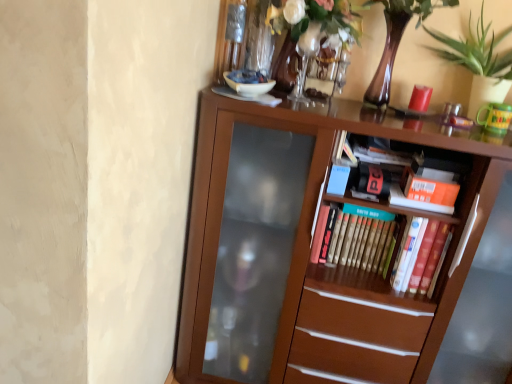
Question: Does hardcover book at center, which appears as the 3th paperback book when viewed from the right, appear on the right side of brown wooden bookcase at center?

Choices:
 (A) no
 (B) yes

Answer: (A)

Question: From a real-world perspective, is hardcover book at center, which appears as the 3th paperback book when viewed from the right, located higher than brown wooden bookcase at center?

Choices:
 (A) yes
 (B) no

Answer: (A)

Question: From the image's perspective, is hardcover book at center, which appears as the 3th paperback book when viewed from the right, on top of brown wooden bookcase at center?

Choices:
 (A) no
 (B) yes

Answer: (B)

Question: Is hardcover book at center, which appears as the 3th paperback book when viewed from the right, aimed at brown wooden bookcase at center?

Choices:
 (A) no
 (B) yes

Answer: (B)

Question: Can you confirm if hardcover book at center, which appears as the 3th paperback book when viewed from the right, is positioned to the left of brown wooden bookcase at center?

Choices:
 (A) yes
 (B) no

Answer: (A)

Question: Looking at their shapes, would you say orange matte paperback book at upper right, arranged as the first paperback book when viewed from the right, is wider or thinner than hardcover book at center, positioned as the second paperback book in left-to-right order?

Choices:
 (A) wide
 (B) thin

Answer: (B)

Question: Is orange matte paperback book at upper right, which is counted as the third paperback book, starting from the left, inside the boundaries of hardcover book at center, positioned as the second paperback book in left-to-right order, or outside?

Choices:
 (A) inside
 (B) outside

Answer: (B)

Question: Considering the positions of point (421, 187) and point (402, 254), is point (421, 187) closer or farther from the camera than point (402, 254)?

Choices:
 (A) farther
 (B) closer

Answer: (B)

Question: Looking at the image, does orange matte paperback book at upper right, arranged as the first paperback book when viewed from the right, seem bigger or smaller compared to hardcover book at center, positioned as the second paperback book in left-to-right order?

Choices:
 (A) small
 (B) big

Answer: (A)

Question: In the image, is brown wooden bookcase at center on the left side or the right side of hardcover book at center, which appears as the 3th paperback book when viewed from the right?

Choices:
 (A) left
 (B) right

Answer: (B)

Question: Does point (361, 364) appear closer or farther from the camera than point (321, 251)?

Choices:
 (A) farther
 (B) closer

Answer: (A)

Question: Considering the positions of brown wooden bookcase at center and hardcover book at center, which appears as the 3th paperback book when viewed from the right, in the image, is brown wooden bookcase at center bigger or smaller than hardcover book at center, which appears as the 3th paperback book when viewed from the right,?

Choices:
 (A) small
 (B) big

Answer: (B)

Question: From their relative heights in the image, would you say brown wooden bookcase at center is taller or shorter than hardcover book at center, which is counted as the 1th paperback book, starting from the left?

Choices:
 (A) tall
 (B) short

Answer: (A)

Question: Based on their positions, is brown wooden bookcase at center located to the left or right of orange matte paperback book at upper right, arranged as the first paperback book when viewed from the right?

Choices:
 (A) left
 (B) right

Answer: (A)

Question: Considering the positions of brown wooden bookcase at center and orange matte paperback book at upper right, which is counted as the third paperback book, starting from the left, in the image, is brown wooden bookcase at center wider or thinner than orange matte paperback book at upper right, which is counted as the third paperback book, starting from the left,?

Choices:
 (A) thin
 (B) wide

Answer: (B)